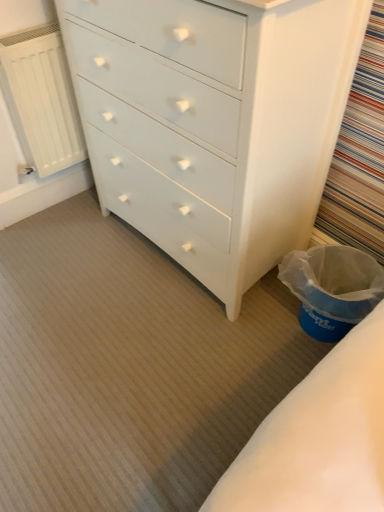
This screenshot has height=512, width=384. Identify the location of vacant space underneath white matte radiator at left (from a real-world perspective). (71, 203).